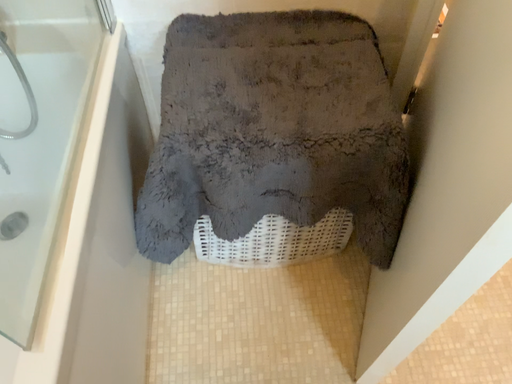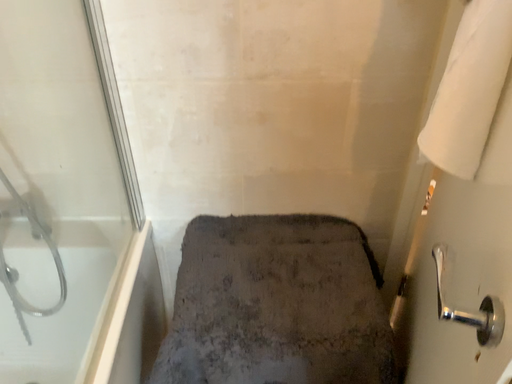
Question: How did the camera likely rotate when shooting the video?

Choices:
 (A) rotated downward
 (B) rotated upward

Answer: (B)